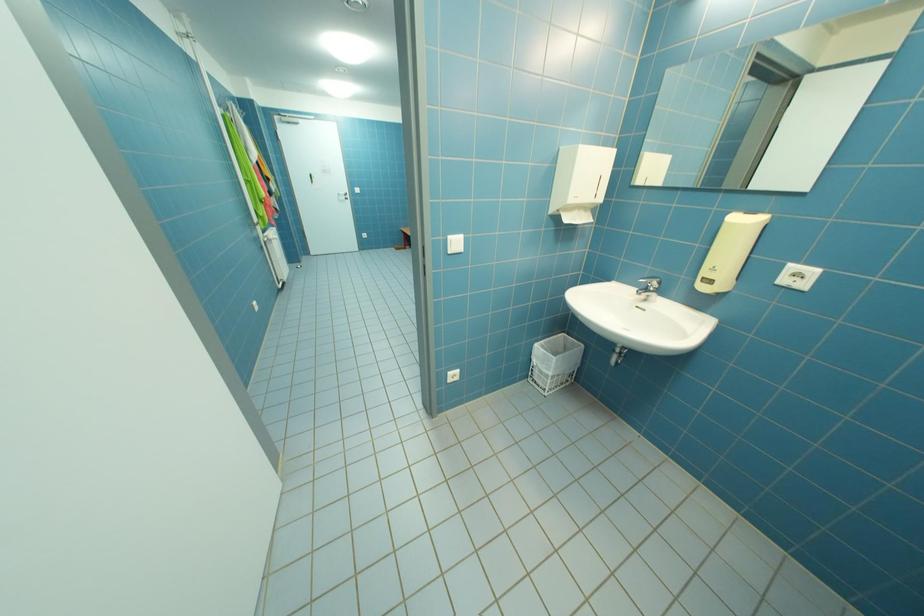
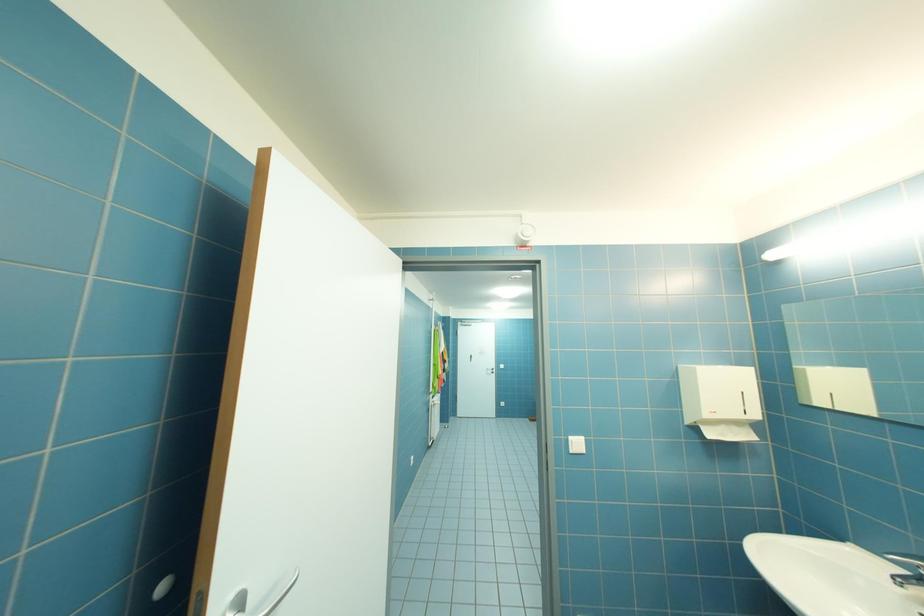
Based on the continuous images, in which direction is the camera rotating?

The rotation direction of the camera is left-up.